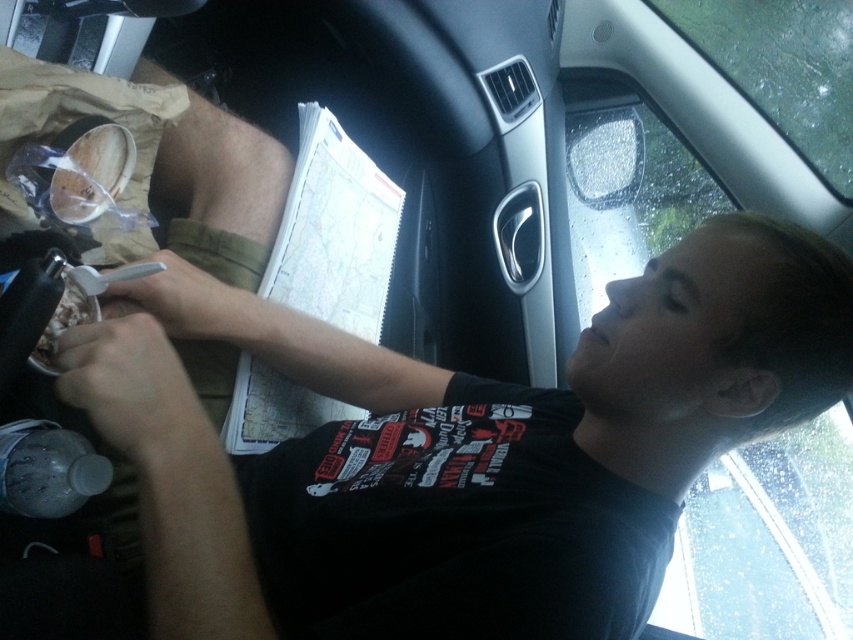
You are a delivery driver who needs to check the weather outside using your phone. You have to decide whether to open the transparent glass car window at upper right or the transparent glass windshield at upper right to stick your phone out. Considering the distance between them, which one allows your phone to be fully extended without hitting the other glass?

The transparent glass car window at upper right and transparent glass windshield at upper right are 10.74 inches apart. Since the distance between them is sufficient, either window can be used to stick the phone out as long as it is positioned carefully to avoid the other glass. However, the windshield is typically stationary, so opening the car window might be more practical for extending the phone without obstruction.

You are inside the car and want to touch the point at coordinates (769, 540). Can you reach it without getting out of the car?

The point at coordinates (769, 540) is on the transparent glass car window at upper right, so you can reach it without getting out of the car.

You are a passenger in the car and want to look outside through the transparent glass car window at upper right and the transparent glass windshield at upper right. Which window allows you to see a taller view?

The transparent glass car window at upper right has a greater height compared to the transparent glass windshield at upper right, so it allows you to see a taller view.